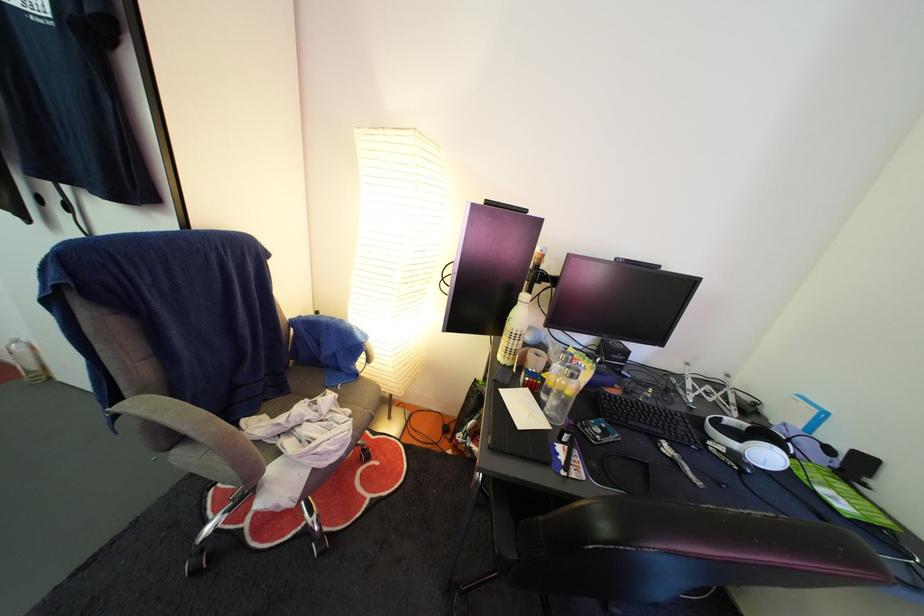
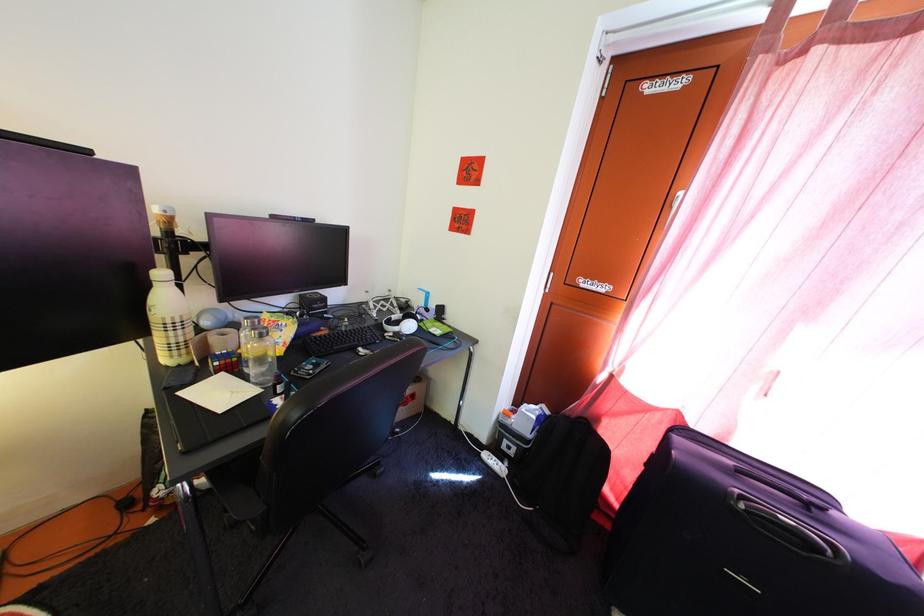
In the second image, find the point that corresponds to point (546, 363) in the first image.

(233, 342)